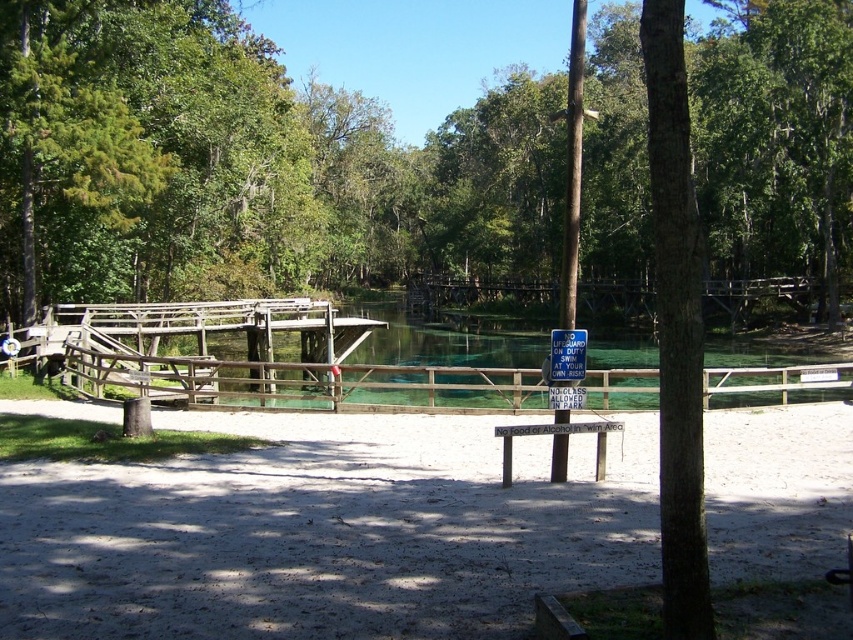
Question: Is green leafy tree at center wider than brown wooden fence at center?

Choices:
 (A) yes
 (B) no

Answer: (A)

Question: Which point is farther to the camera?

Choices:
 (A) brown wooden fence at center
 (B) green leafy tree at center
 (C) white sandy ground at center

Answer: (A)

Question: Which object is farther from the camera taking this photo?

Choices:
 (A) brown wooden fence at center
 (B) green leafy tree at center

Answer: (A)

Question: Does green leafy tree at center appear on the left side of white sandy ground at center?

Choices:
 (A) yes
 (B) no

Answer: (A)

Question: Does green leafy tree at center have a greater width compared to brown wooden fence at center?

Choices:
 (A) no
 (B) yes

Answer: (B)

Question: Which point is closer to the camera taking this photo?

Choices:
 (A) (616, 300)
 (B) (761, 536)
 (C) (177, 221)

Answer: (B)